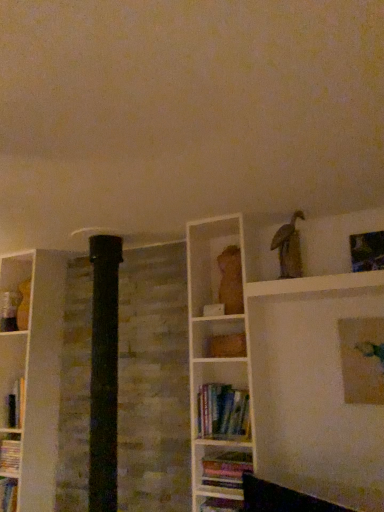
Question: Is the depth of matte gold picture frame at upper right, the 2th picture frame from the top, greater than that of hardcover books at center, which is the 1th book in top-to-bottom order?

Choices:
 (A) no
 (B) yes

Answer: (A)

Question: Is matte gold picture frame at upper right, placed as the 1th picture frame when sorted from bottom to top, oriented towards hardcover books at center, which is the 1th book in top-to-bottom order?

Choices:
 (A) yes
 (B) no

Answer: (B)

Question: Is hardcover books at center, which is the 1th book in top-to-bottom order, completely or partially inside matte gold picture frame at upper right, the 2th picture frame from the top?

Choices:
 (A) yes
 (B) no

Answer: (B)

Question: Is matte gold picture frame at upper right, the 2th picture frame from the top, not near hardcover books at center, the second book when ordered from bottom to top?

Choices:
 (A) yes
 (B) no

Answer: (B)

Question: Is matte gold picture frame at upper right, placed as the 1th picture frame when sorted from bottom to top, touching hardcover books at center, the second book when ordered from bottom to top?

Choices:
 (A) no
 (B) yes

Answer: (A)

Question: Is point (370, 267) closer or farther from the camera than point (231, 426)?

Choices:
 (A) farther
 (B) closer

Answer: (B)

Question: From the image's perspective, is metallic silver picture frame at upper right, which appears as the 1th picture frame when viewed from the top, positioned above or below hardcover books at center, the second book when ordered from bottom to top?

Choices:
 (A) below
 (B) above

Answer: (B)

Question: Would you say metallic silver picture frame at upper right, which is the second picture frame in bottom-to-top order, is inside or outside hardcover books at center, which is the 1th book in top-to-bottom order?

Choices:
 (A) inside
 (B) outside

Answer: (B)

Question: In terms of width, does metallic silver picture frame at upper right, which is the second picture frame in bottom-to-top order, look wider or thinner when compared to hardcover books at center, which is the 1th book in top-to-bottom order?

Choices:
 (A) wide
 (B) thin

Answer: (B)

Question: From the image's perspective, is matte gold picture frame at upper right, placed as the 1th picture frame when sorted from bottom to top, located above or below hardcover books at center, the second book when ordered from bottom to top?

Choices:
 (A) below
 (B) above

Answer: (B)

Question: Which is correct: matte gold picture frame at upper right, the 2th picture frame from the top, is inside hardcover books at center, which is the 1th book in top-to-bottom order, or outside of it?

Choices:
 (A) inside
 (B) outside

Answer: (B)

Question: Looking at the image, does matte gold picture frame at upper right, the 2th picture frame from the top, seem bigger or smaller compared to hardcover books at center, which is the 1th book in top-to-bottom order?

Choices:
 (A) big
 (B) small

Answer: (B)

Question: Does point (355, 387) appear closer or farther from the camera than point (243, 421)?

Choices:
 (A) closer
 (B) farther

Answer: (A)

Question: From the image's perspective, is matte gold picture frame at upper right, placed as the 1th picture frame when sorted from bottom to top, located above or below multicolored paper book at lower center, which appears as the second book when viewed from the top?

Choices:
 (A) below
 (B) above

Answer: (B)

Question: Is matte gold picture frame at upper right, the 2th picture frame from the top, in front of or behind multicolored paper book at lower center, the first book positioned from the bottom, in the image?

Choices:
 (A) behind
 (B) front

Answer: (B)